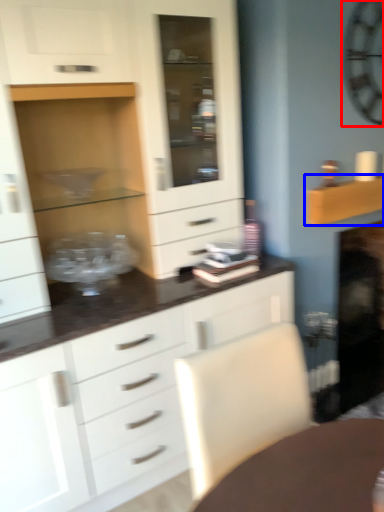
Question: Which object is closer to the camera taking this photo, clock (highlighted by a red box) or shelf (highlighted by a blue box)?

Choices:
 (A) clock
 (B) shelf

Answer: (A)